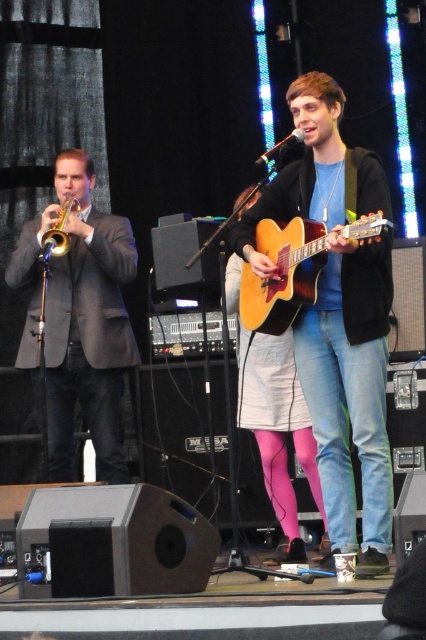
Question: Is matte black suit at left smaller than brass shiny trumpet at left?

Choices:
 (A) yes
 (B) no

Answer: (B)

Question: Does blue jeans at center have a smaller size compared to brass shiny trumpet at left?

Choices:
 (A) no
 (B) yes

Answer: (A)

Question: Among these points, which one is nearest to the camera?

Choices:
 (A) (270, 324)
 (B) (36, 298)
 (C) (385, 564)

Answer: (C)

Question: Which of the following is the farthest from the observer?

Choices:
 (A) acoustic wood guitar at center
 (B) matte black guitar at center
 (C) blue jeans at center
 (D) brass shiny trumpet at left

Answer: (D)

Question: Can you confirm if matte black suit at left is thinner than acoustic wood guitar at center?

Choices:
 (A) no
 (B) yes

Answer: (A)

Question: Which of these objects is positioned closest to the matte black guitar at center?

Choices:
 (A) acoustic wood guitar at center
 (B) brass shiny trumpet at left

Answer: (A)